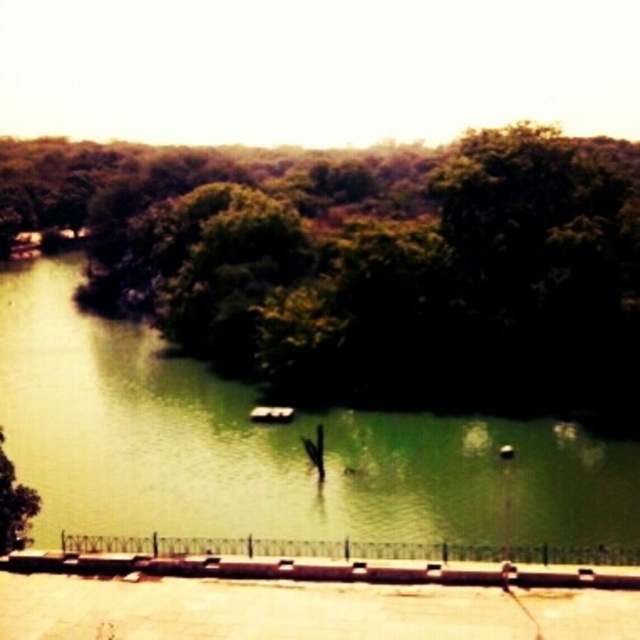
You are standing on the paved area near the metal railing and want to look at the green leafy tree at center and the green water at center. Which object is higher from the ground?

The green leafy tree at center is located above green water at center, so the green leafy tree at center is higher from the ground.